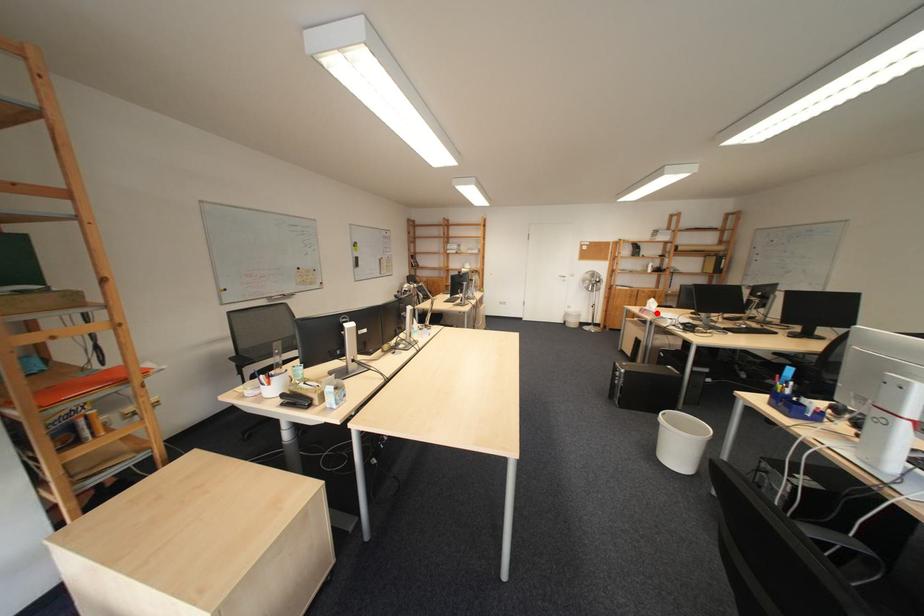
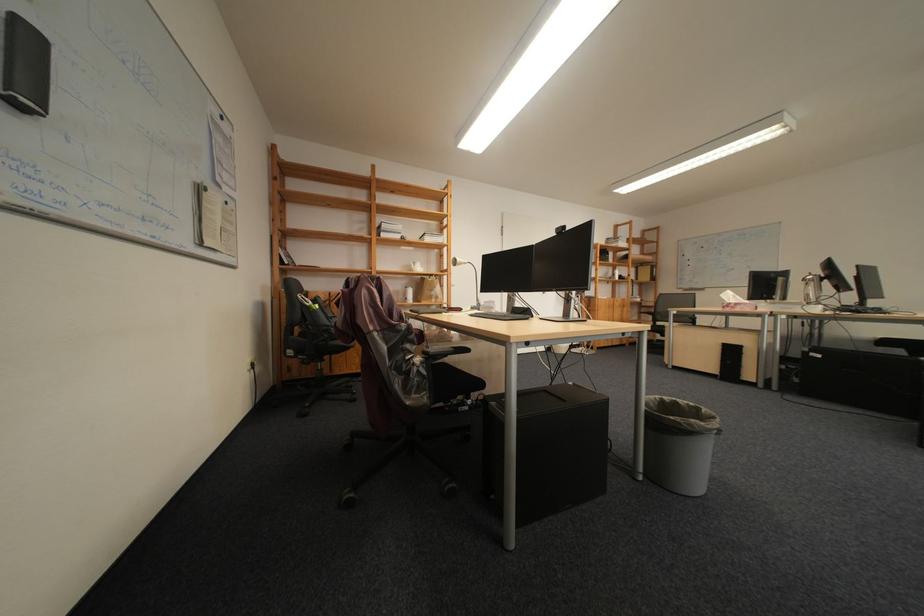
The point at the highlighted location is marked in the first image. Where is the corresponding point in the second image?

(747, 309)